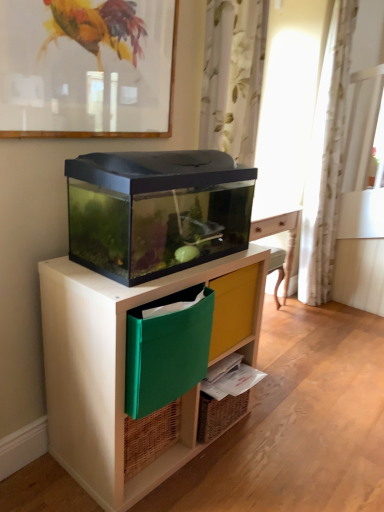
Question: Considering the positions of white floral fabric curtain at upper center, which is counted as the 2th curtain, starting from the right, and green fabric file at lower center in the image, is white floral fabric curtain at upper center, which is counted as the 2th curtain, starting from the right, wider or thinner than green fabric file at lower center?

Choices:
 (A) wide
 (B) thin

Answer: (B)

Question: Considering the relative positions of white floral fabric curtain at upper center, the second curtain from the back, and green fabric file at lower center in the image provided, is white floral fabric curtain at upper center, the second curtain from the back, to the left or to the right of green fabric file at lower center?

Choices:
 (A) left
 (B) right

Answer: (B)

Question: Based on their relative distances, which object is nearer to the green fabric file at lower center?

Choices:
 (A) white floral fabric curtain at upper center, which is counted as the 2th curtain, starting from the right
 (B) matte black aquarium at center
 (C) matte glass picture frame at upper center
 (D) white floral fabric curtain at right, which appears as the 2th curtain when viewed from the left

Answer: (B)

Question: Estimate the real-world distances between objects in this image. Which object is closer to the green fabric file at lower center?

Choices:
 (A) white floral fabric curtain at right, acting as the 1th curtain starting from the right
 (B) matte black aquarium at center
 (C) white floral fabric curtain at upper center, which is counted as the 1th curtain, starting from the left
 (D) matte glass picture frame at upper center

Answer: (B)